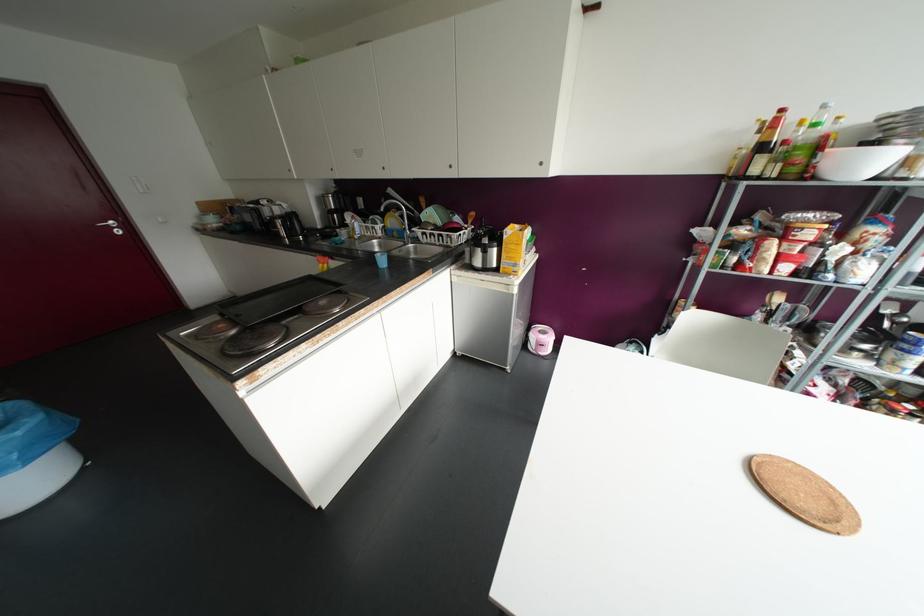
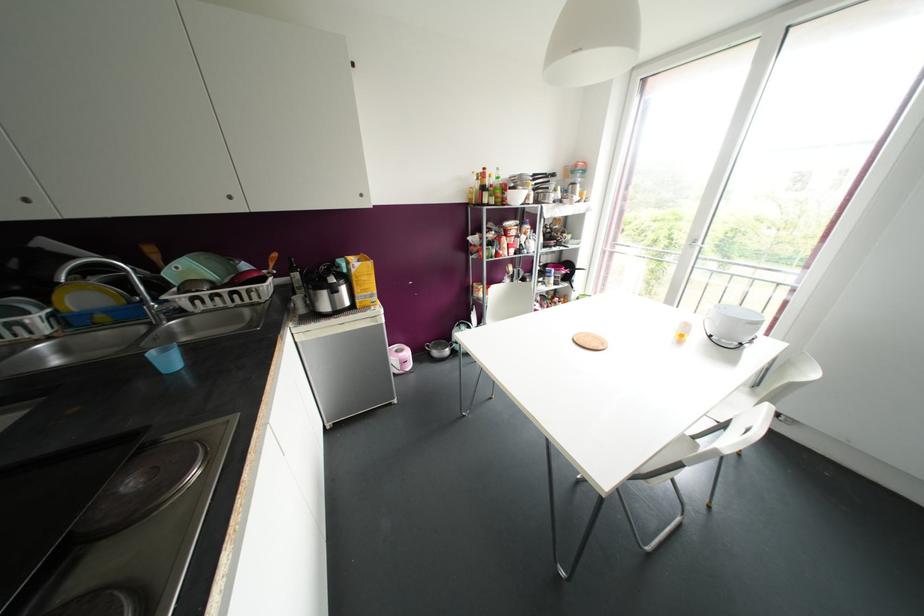
Where in the second image is the point corresponding to pixel 415 238 from the first image?

(178, 312)